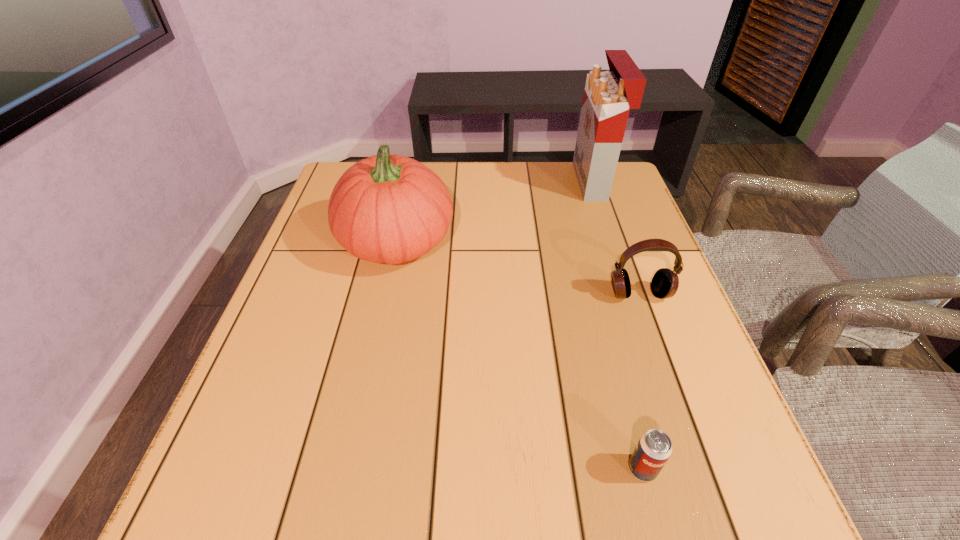
This screenshot has width=960, height=540. Find the location of `cigarette case`. cigarette case is located at coordinates (608, 96).

Locate an element on the screen. This screenshot has height=540, width=960. the farthest object is located at coordinates (608, 96).

Identify the location of the second tallest object. (390, 209).

What are the coordinates of `pumpkin` in the screenshot? It's located at (390, 209).

I want to click on the third farthest object, so click(x=665, y=282).

Locate an element on the screen. The width and height of the screenshot is (960, 540). the third tallest object is located at coordinates (665, 282).

Where is `the nearest object`? Image resolution: width=960 pixels, height=540 pixels. the nearest object is located at coordinates (654, 448).

The height and width of the screenshot is (540, 960). What are the coordinates of `the shortest object` in the screenshot? It's located at (654, 448).

The height and width of the screenshot is (540, 960). Find the location of `vacant region located with the lid open on the farthest object`. vacant region located with the lid open on the farthest object is located at coordinates (501, 181).

Image resolution: width=960 pixels, height=540 pixels. I want to click on free space located with the lid open on the farthest object, so click(x=456, y=181).